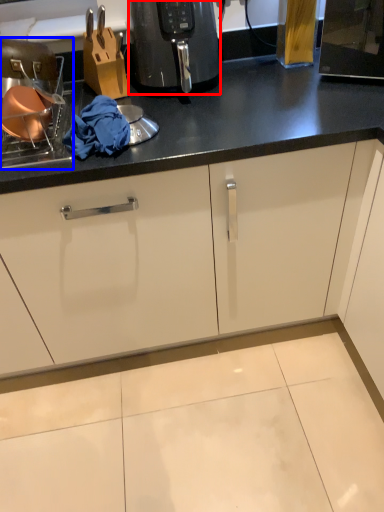
Question: Which of the following is the closest to the observer, home appliance (highlighted by a red box) or appliance (highlighted by a blue box)?

Choices:
 (A) home appliance
 (B) appliance

Answer: (B)